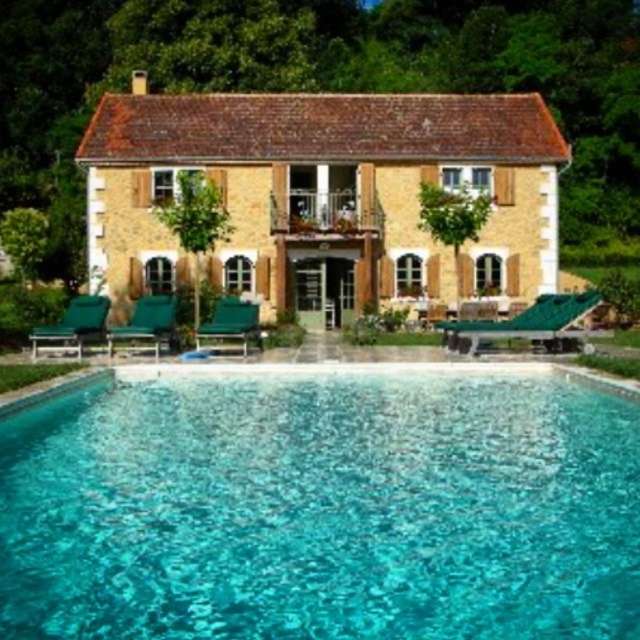
Consider the image. You are planning to place a new decorative planter between the green plastic lounge chair at center and the green fabric chair at center. Since both chairs are at the center, how can you determine where to place the planter so it is equidistant from both?

The green plastic lounge chair at center is positioned over the green fabric chair at center, so placing the planter directly above the green fabric chair at center would place it equidistant between both chairs.

You are standing at the edge of the rectangular swimming pool with clear blue water. You want to reach the point marked as point (3,454). Is this point within the pool area?

The distance between you and point (3,454) is 13.97 meters. Since the pool is rectangular and the point is within its area, you can reach it by swimming 13.97 meters from the edge.

You are standing at the entrance of the stone house and want to find the green plastic lounge chair at center. According to the scene description, where should you look relative to the house?

The green plastic lounge chair at center is located at the coordinates (528, 323), which would be in the central area of the image, directly in front of the stone house. Since the house is in the background, the chair is positioned towards the middle of the lawn area in front of it.